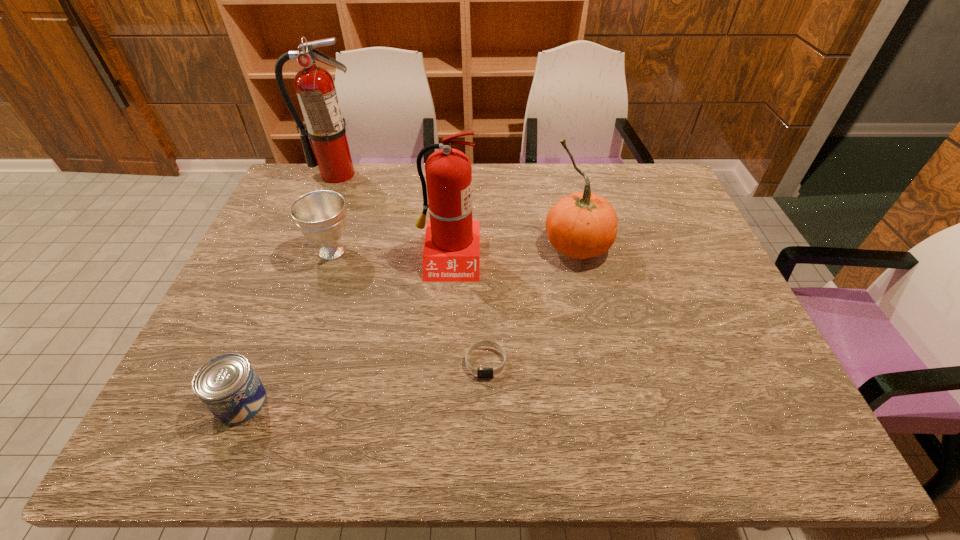
Identify the location of free space in the image that satisfies the following two spatial constraints: 1. on the nozzle side of the farthest object; 2. on the front label of the can. (245, 402).

Where is `vacant space that satisfies the following two spatial constraints: 1. on the outer surface of the fifth farthest object; 2. on the front label of the can`? vacant space that satisfies the following two spatial constraints: 1. on the outer surface of the fifth farthest object; 2. on the front label of the can is located at coordinates (486, 402).

Locate an element on the screen. The image size is (960, 540). vacant area in the image that satisfies the following two spatial constraints: 1. on the nozzle side of the left fire extinguisher; 2. on the right side of the rightmost object is located at coordinates (308, 246).

What are the coordinates of `vacant position in the image that satisfies the following two spatial constraints: 1. on the nozzle side of the fourth tallest object; 2. on the left side of the tallest object` in the screenshot? It's located at (306, 251).